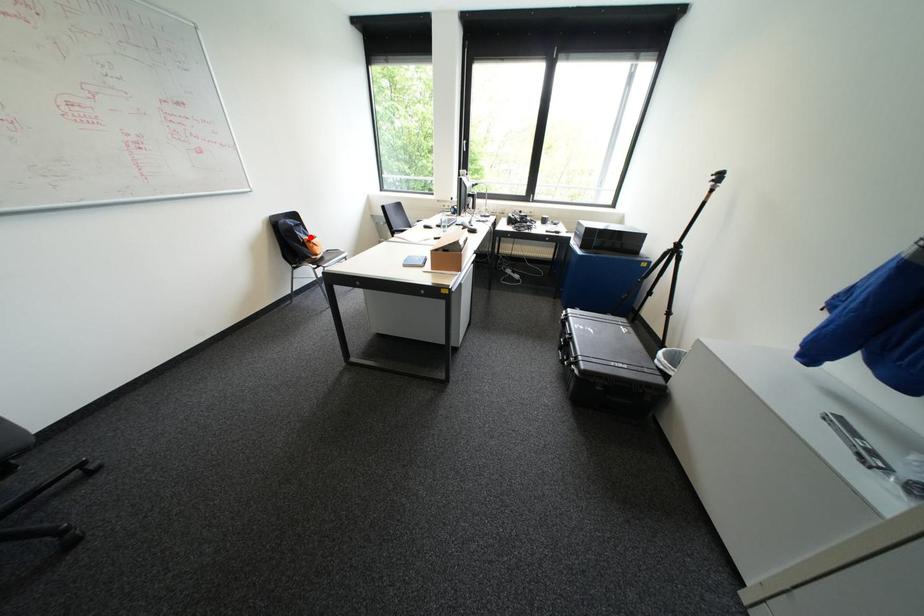
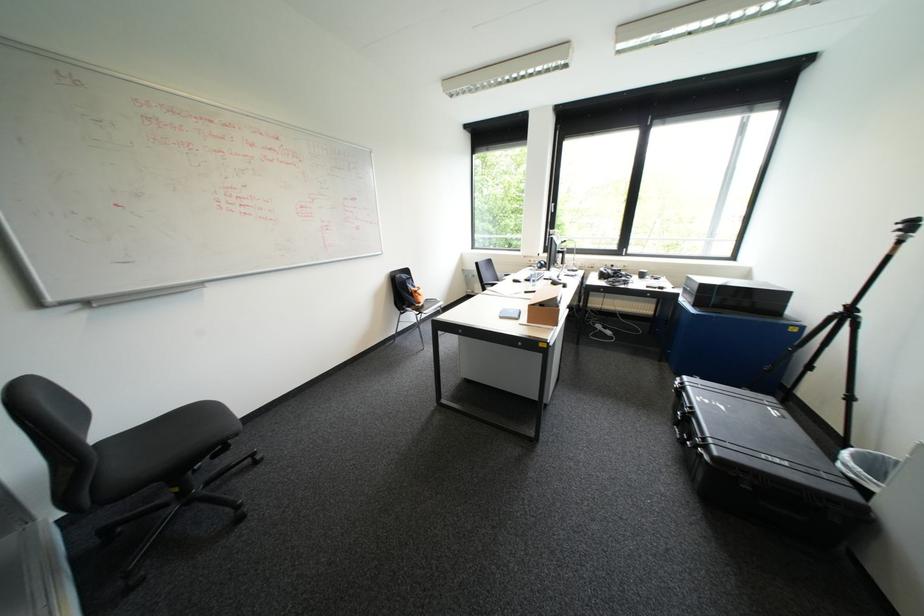
In the second image, find the point that corresponds to the highlighted location in the first image.

(419, 288)